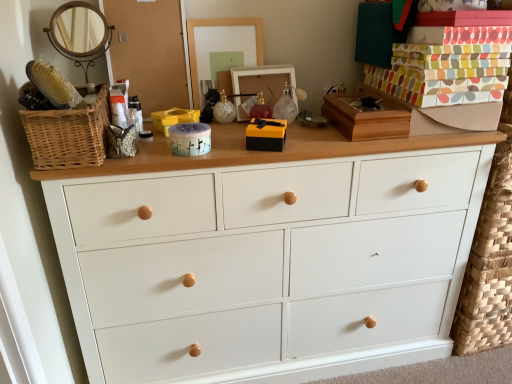
What do you see at coordinates (268, 255) in the screenshot? I see `white painted wood chest of drawers at center` at bounding box center [268, 255].

Describe the element at coordinates (219, 25) in the screenshot. I see `matte wooden mirror at upper center` at that location.

Locate an element on the screen. The image size is (512, 384). matte glass ornament at center is located at coordinates (224, 109).

From the picture: What is the approximate height of yellow plastic storage box at center?

yellow plastic storage box at center is 2.53 inches tall.

Find the location of `woven wood basket at left`. woven wood basket at left is located at coordinates (69, 134).

The width and height of the screenshot is (512, 384). What are the coordinates of `white painted wood chest of drawers at center` in the screenshot? It's located at (268, 255).

Is yellow matte/black textured box at center, which ranks as the 2th box in left-to-right order, not close to translucent plastic tube at center?

They are positioned close to each other.

Considering the relative sizes of yellow matte/black textured box at center, which ranks as the second box in right-to-left order, and translucent plastic tube at center in the image provided, is yellow matte/black textured box at center, which ranks as the second box in right-to-left order, bigger than translucent plastic tube at center?

Yes, yellow matte/black textured box at center, which ranks as the second box in right-to-left order, is bigger than translucent plastic tube at center.

Measure the distance between yellow matte/black textured box at center, which ranks as the second box in right-to-left order, and translucent plastic tube at center.

The distance of yellow matte/black textured box at center, which ranks as the second box in right-to-left order, from translucent plastic tube at center is 38.88 centimeters.

How different are the orientations of yellow matte/black textured box at center, which ranks as the 2th box in left-to-right order, and translucent plastic tube at center in degrees?

They differ by 16.6 degrees in their facing directions.

Which is behind, matte purple container at center, positioned as the third box in right-to-left order, or wooden picture frame at center?

Positioned behind is wooden picture frame at center.

Does point (202, 142) appear closer or farther from the camera than point (272, 104)?

Point (202, 142) appears to be closer to the viewer than point (272, 104).

Is wooden picture frame at center at the back of matte purple container at center, positioned as the third box in right-to-left order?

No.

Is wooden picture frame at center a part of matte purple container at center, positioned as the third box in right-to-left order?

Definitely not — wooden picture frame at center is not inside matte purple container at center, positioned as the third box in right-to-left order.

From a real-world perspective, is yellow plastic storage box at center on top of translucent plastic tube at center?

No.

Is yellow plastic storage box at center facing towards translucent plastic tube at center?

No, yellow plastic storage box at center is not turned towards translucent plastic tube at center.

Based on the photo, would you say yellow plastic storage box at center is to the left or to the right of translucent plastic tube at center in the picture?

yellow plastic storage box at center is to the right of translucent plastic tube at center.

Can you tell me how much white painted wood chest of drawers at center and yellow matte/black textured box at center, which ranks as the second box in right-to-left order, differ in facing direction?

The angle between the facing direction of white painted wood chest of drawers at center and the facing direction of yellow matte/black textured box at center, which ranks as the second box in right-to-left order, is 19.7 degrees.

Is white painted wood chest of drawers at center taller than yellow matte/black textured box at center, which ranks as the second box in right-to-left order?

Yes.

Considering the points (391, 345) and (267, 123), which point is behind, point (391, 345) or point (267, 123)?

Positioned behind is point (391, 345).

How different are the orientations of woven wood basket at left and matte wooden mirror at upper center in degrees?

The angle between the facing direction of woven wood basket at left and the facing direction of matte wooden mirror at upper center is 4.51 degrees.

Is woven wood basket at left not within matte wooden mirror at upper center?

woven wood basket at left lies outside matte wooden mirror at upper center's area.

From the picture: Is woven wood basket at left thinner than matte wooden mirror at upper center?

No, woven wood basket at left is not thinner than matte wooden mirror at upper center.

Does woven wood basket at left appear on the left side of matte wooden mirror at upper center?

Yes, woven wood basket at left is to the left of matte wooden mirror at upper center.

Is yellow matte/black textured box at center, which ranks as the 2th box in left-to-right order, oriented towards yellow plastic storage box at center?

No, yellow matte/black textured box at center, which ranks as the 2th box in left-to-right order, is not turned towards yellow plastic storage box at center.

Is yellow matte/black textured box at center, which ranks as the 2th box in left-to-right order, not close to yellow plastic storage box at center?

Actually, yellow matte/black textured box at center, which ranks as the 2th box in left-to-right order, and yellow plastic storage box at center are a little close together.

Between yellow matte/black textured box at center, which ranks as the 2th box in left-to-right order, and yellow plastic storage box at center, which one has larger width?

With larger width is yellow plastic storage box at center.

Does yellow matte/black textured box at center, which ranks as the second box in right-to-left order, have a smaller size compared to yellow plastic storage box at center?

Yes.

Is matte wooden mirror at upper center positioned with its back to matte purple container at center, positioned as the third box in right-to-left order?

No, matte wooden mirror at upper center's orientation is not away from matte purple container at center, positioned as the third box in right-to-left order.

Based on their positions, is matte wooden mirror at upper center located to the left or right of matte purple container at center, positioned as the third box in right-to-left order?

matte wooden mirror at upper center is positioned on matte purple container at center, positioned as the third box in right-to-left order,'s right side.

In order to click on mirror behind the matte purple container at center, positioned as the third box in right-to-left order in this screenshot , I will do `click(219, 25)`.

Is matte wooden mirror at upper center shorter than matte purple container at center, the 1th box positioned from the left?

No, matte wooden mirror at upper center is not shorter than matte purple container at center, the 1th box positioned from the left.

Identify the location of the 1st box in front of the translucent plastic tube at center, starting your count from the anchor. (266, 135).

Find the location of a particular element. This screenshot has width=512, height=384. box that appears on the left of wooden picture frame at center is located at coordinates (190, 139).

Considering their positions, is matte glass ornament at center positioned further to matte wooden mirror at upper center than translucent plastic tube at center?

Among the two, translucent plastic tube at center is located further to matte wooden mirror at upper center.

Considering their positions, is yellow plastic storage box at center positioned closer to matte purple container at center, the 1th box positioned from the left, than translucent plastic tube at center?

yellow plastic storage box at center.

Looking at the image, which one is located further to matte purple container at center, the 1th box positioned from the left, matte glass ornament at center or yellow plastic storage box at center?

matte glass ornament at center is positioned further to the anchor matte purple container at center, the 1th box positioned from the left.

From the image, which object appears to be farther from yellow matte/black textured box at center, which ranks as the 2th box in left-to-right order, white painted wood chest of drawers at center or woven wood basket at left?

white painted wood chest of drawers at center lies further to yellow matte/black textured box at center, which ranks as the 2th box in left-to-right order, than the other object.

Looking at the image, which one is located closer to woven wood basket at left, wooden picture frame at center or matte glass ornament at center?

The object closer to woven wood basket at left is matte glass ornament at center.

Looking at the image, which one is located closer to matte wooden mirror at upper center, woven wood basket at left or white painted wood chest of drawers at center?

woven wood basket at left is positioned closer to the anchor matte wooden mirror at upper center.

Which object lies nearer to the anchor point white painted wood chest of drawers at center, matte purple container at center, positioned as the third box in right-to-left order, or yellow plastic storage box at center?

matte purple container at center, positioned as the third box in right-to-left order, is closer to white painted wood chest of drawers at center.

Looking at the image, which one is located closer to matte glass ornament at center, yellow matte/black textured box at center, which ranks as the 2th box in left-to-right order, or yellow plastic storage box at center?

yellow plastic storage box at center is closer to matte glass ornament at center.

Find the location of a particular element. box situated between translucent plastic tube at center and yellow matte/black textured box at center, which ranks as the second box in right-to-left order, from left to right is located at coordinates (190, 139).

The height and width of the screenshot is (384, 512). Identify the location of picture frame that lies between matte wooden mirror at upper center and yellow matte/black textured box at center, which ranks as the second box in right-to-left order, from top to bottom. (260, 84).

Image resolution: width=512 pixels, height=384 pixels. What are the coordinates of `toiletry between woven wood basket at left and wooden picture frame at center from left to right` in the screenshot? It's located at pos(137,111).

In order to click on mirror between matte purple container at center, positioned as the third box in right-to-left order, and matte glass ornament at center in the front-back direction in this screenshot , I will do `click(219, 25)`.